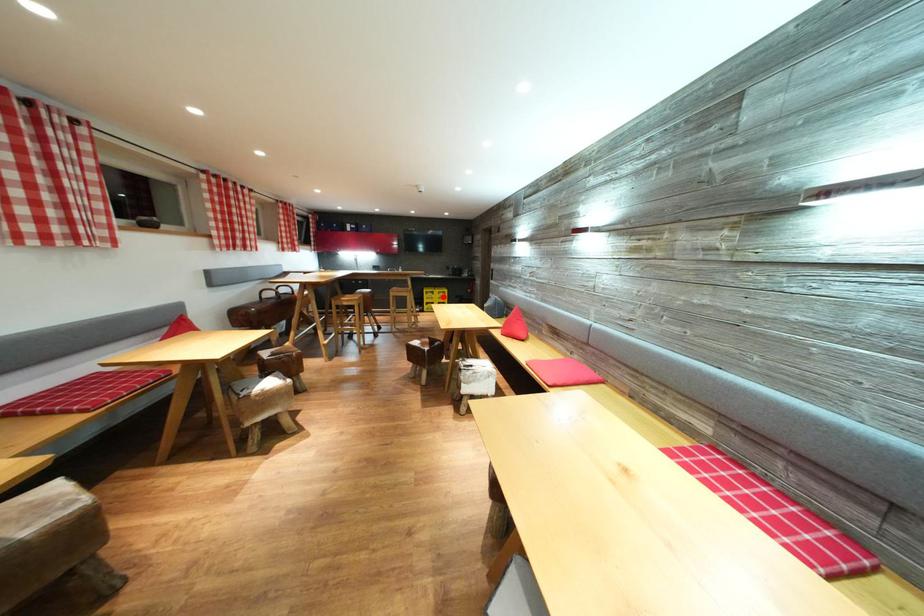
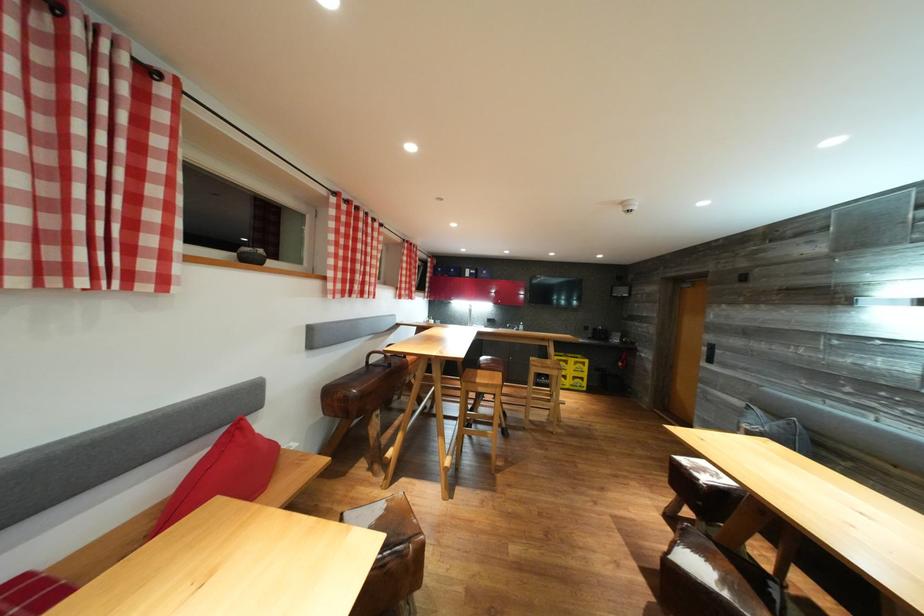
Question: I am providing you with two images of the same scene from different viewpoints. A red point is shown in image1. For the corresponding object point in image2, is it positioned nearer or farther from the camera?

Choices:
 (A) Nearer
 (B) Farther

Answer: (B)